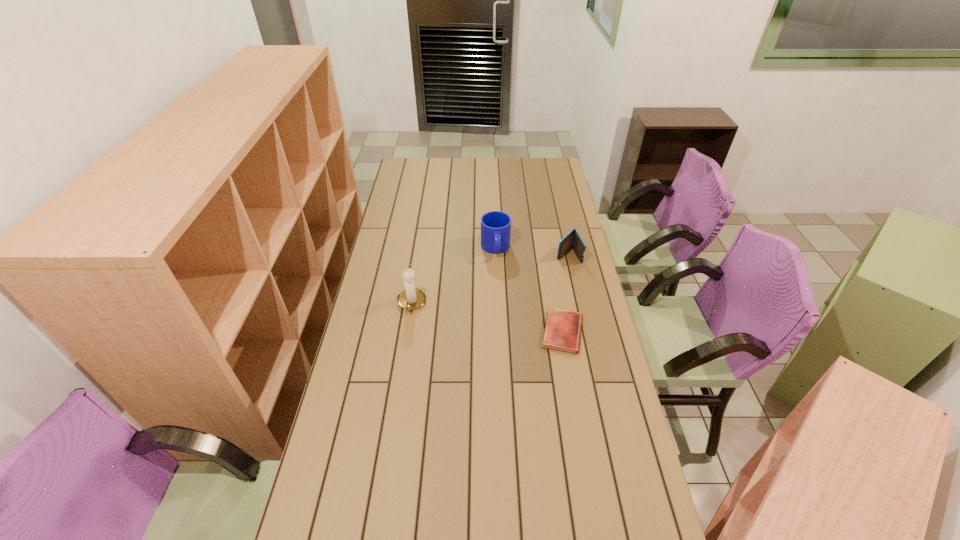
This screenshot has height=540, width=960. Identify the location of vacant area that lies between the diary and the third shortest object. (529, 290).

Where is `free point between the wallet and the shortest object`? This screenshot has height=540, width=960. free point between the wallet and the shortest object is located at coordinates (565, 293).

I want to click on free area in between the diary and the mug, so click(529, 290).

Where is `unoccupied area between the leftmost object and the third shortest object`? This screenshot has width=960, height=540. unoccupied area between the leftmost object and the third shortest object is located at coordinates (453, 276).

Where is `object that stands as the closest to the second object from left to right`? Image resolution: width=960 pixels, height=540 pixels. object that stands as the closest to the second object from left to right is located at coordinates (573, 239).

Select which object is the second closest to the second shortest object. Please provide its 2D coordinates. Your answer should be formatted as a tuple, i.e. [(x, y)], where the tuple contains the x and y coordinates of a point satisfying the conditions above.

[(562, 332)]

Where is `vacant space that satisfies the following two spatial constraints: 1. on the front side of the mug; 2. on the left side of the second shortest object`? The width and height of the screenshot is (960, 540). vacant space that satisfies the following two spatial constraints: 1. on the front side of the mug; 2. on the left side of the second shortest object is located at coordinates (495, 255).

The height and width of the screenshot is (540, 960). What are the coordinates of `free location that satisfies the following two spatial constraints: 1. on the handle side of the diary; 2. on the left side of the tallest object` in the screenshot? It's located at (407, 332).